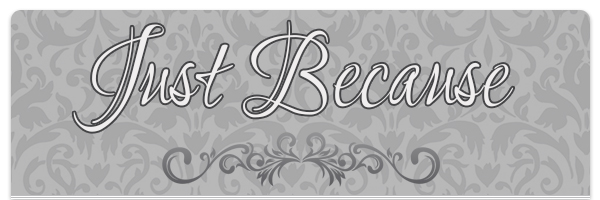
Find the location of a particular element. The image size is (600, 200). decorative graphic is located at coordinates (263, 160), (352, 160).